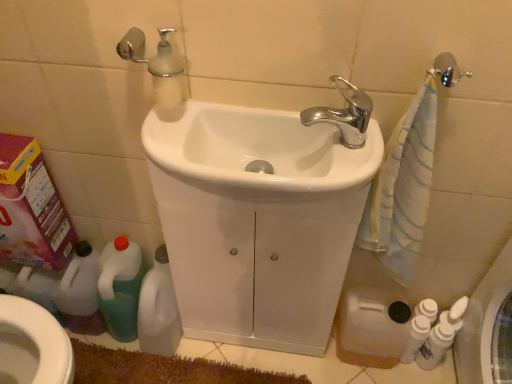
Find the location of a particular element. The width and height of the screenshot is (512, 384). space that is in front of chrome metallic faucet at upper center is located at coordinates [x=336, y=174].